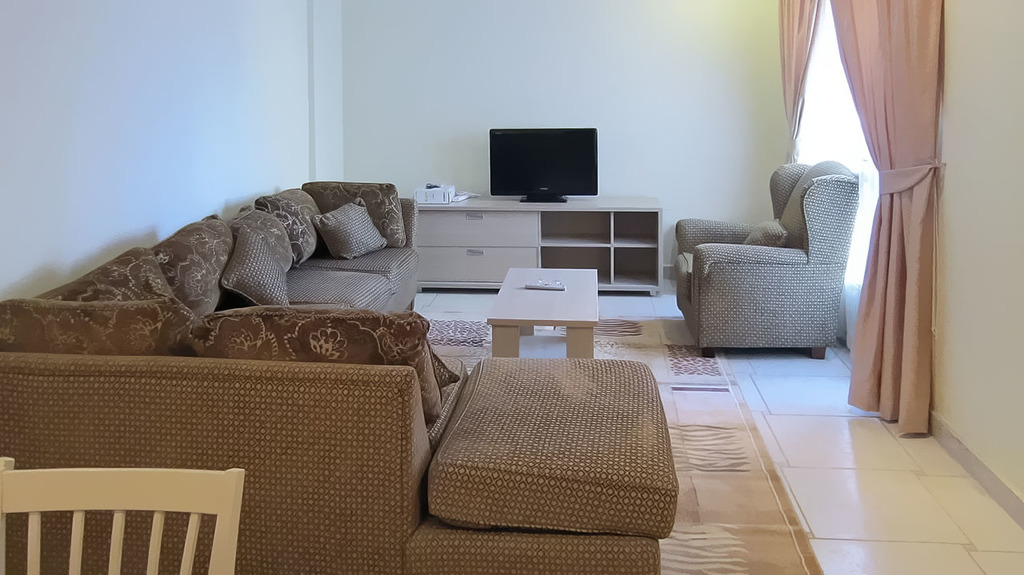
Find the location of `coffee table`. coffee table is located at coordinates (579, 317).